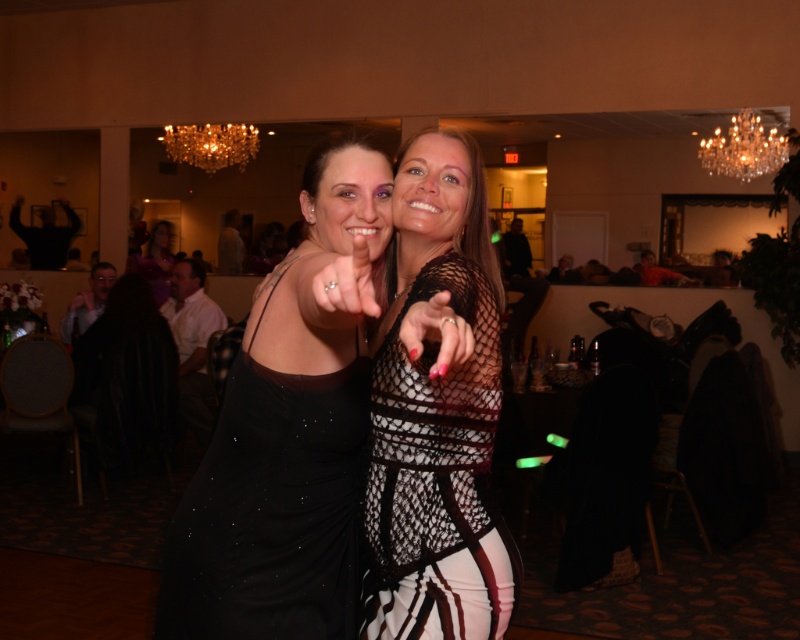
Question: Is matte black ring at center to the right of matte black nail at center from the viewer's perspective?

Choices:
 (A) no
 (B) yes

Answer: (A)

Question: Is matte black ring at center wider than matte purple dress at center?

Choices:
 (A) no
 (B) yes

Answer: (A)

Question: Is the position of black mesh dress at center more distant than that of matte purple dress at center?

Choices:
 (A) yes
 (B) no

Answer: (B)

Question: Which object appears closest to the camera in this image?

Choices:
 (A) matte black nail at center
 (B) black sequined dress at center
 (C) gold crystal chandelier at upper center
 (D) matte purple dress at center

Answer: (A)

Question: Which point is closer to the camera?

Choices:
 (A) (216, 163)
 (B) (470, 481)
 (C) (472, 333)

Answer: (C)

Question: Which point appears farthest from the camera in this image?

Choices:
 (A) (408, 356)
 (B) (384, 557)

Answer: (B)